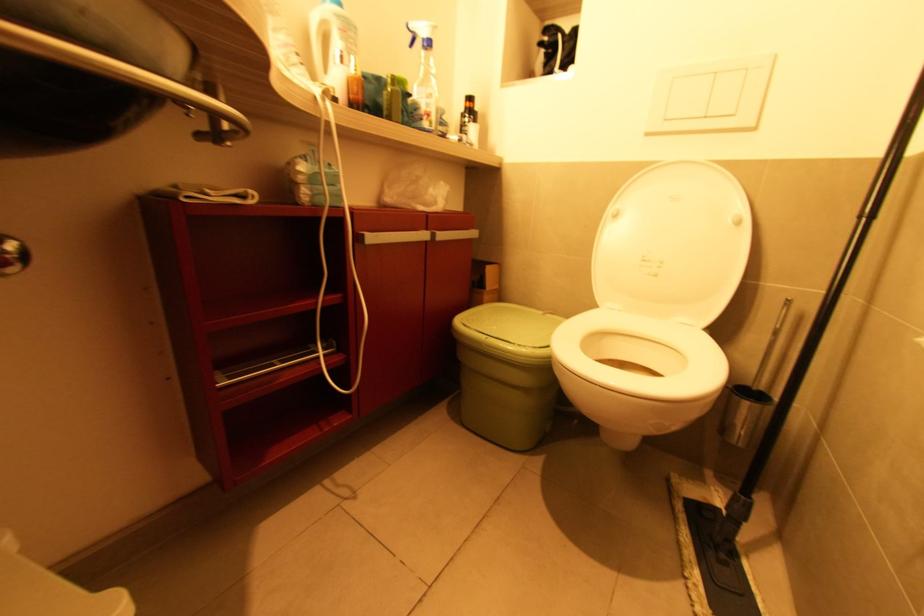
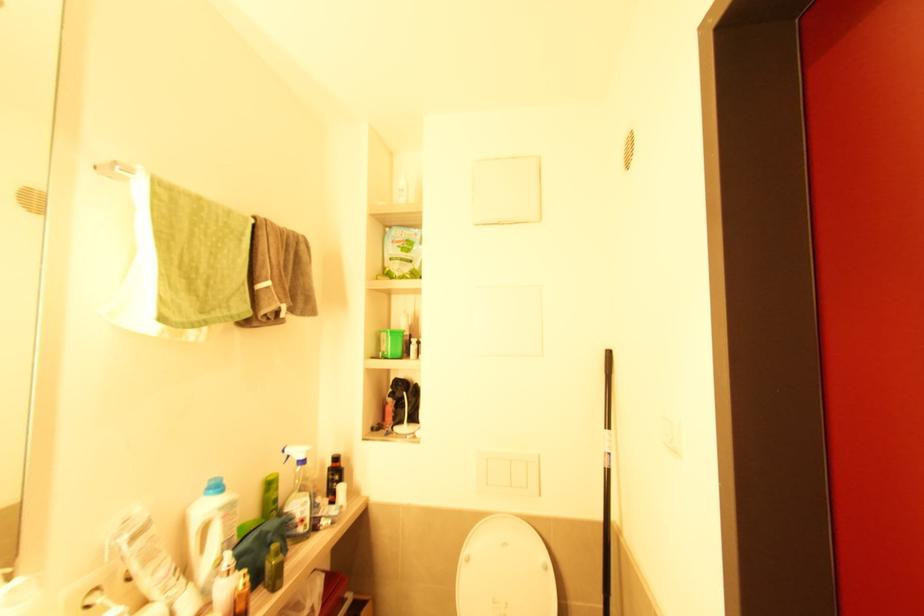
Question: I am providing you with two images of the same scene from different viewpoints. Which of the following objects are not visible in image2?

Choices:
 (A) small amber bottle
 (B) white spray bottle
 (C) white toilet lid
 (D) none of these

Answer: (D)